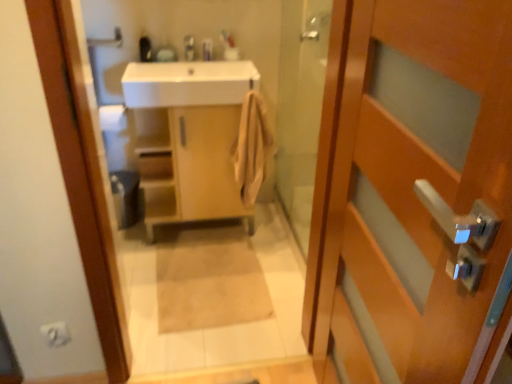
Question: From a real-world perspective, is beige fabric bath mat at center located beneath beige cotton towel at center?

Choices:
 (A) yes
 (B) no

Answer: (A)

Question: Is there a large distance between beige fabric bath mat at center and beige cotton towel at center?

Choices:
 (A) yes
 (B) no

Answer: (B)

Question: Does beige fabric bath mat at center have a greater height compared to beige cotton towel at center?

Choices:
 (A) yes
 (B) no

Answer: (B)

Question: Is beige fabric bath mat at center positioned behind beige cotton towel at center?

Choices:
 (A) yes
 (B) no

Answer: (B)

Question: Does beige fabric bath mat at center have a greater width compared to beige cotton towel at center?

Choices:
 (A) no
 (B) yes

Answer: (B)

Question: Is beige fabric bath mat at center not within beige cotton towel at center?

Choices:
 (A) yes
 (B) no

Answer: (A)

Question: From the image's perspective, would you say beige fabric bath mat at center is shown under matte silver faucet at upper center?

Choices:
 (A) no
 (B) yes

Answer: (B)

Question: Could you tell me if beige fabric bath mat at center is facing matte silver faucet at upper center?

Choices:
 (A) no
 (B) yes

Answer: (A)

Question: Does beige fabric bath mat at center have a larger size compared to matte silver faucet at upper center?

Choices:
 (A) no
 (B) yes

Answer: (B)

Question: From a real-world perspective, does beige fabric bath mat at center sit lower than matte silver faucet at upper center?

Choices:
 (A) yes
 (B) no

Answer: (A)

Question: Is beige fabric bath mat at center outside matte silver faucet at upper center?

Choices:
 (A) no
 (B) yes

Answer: (B)

Question: Does beige fabric bath mat at center come behind matte silver faucet at upper center?

Choices:
 (A) no
 (B) yes

Answer: (A)

Question: Can white matte toilet paper at lower left be found inside light wood cabinet at center?

Choices:
 (A) no
 (B) yes

Answer: (A)